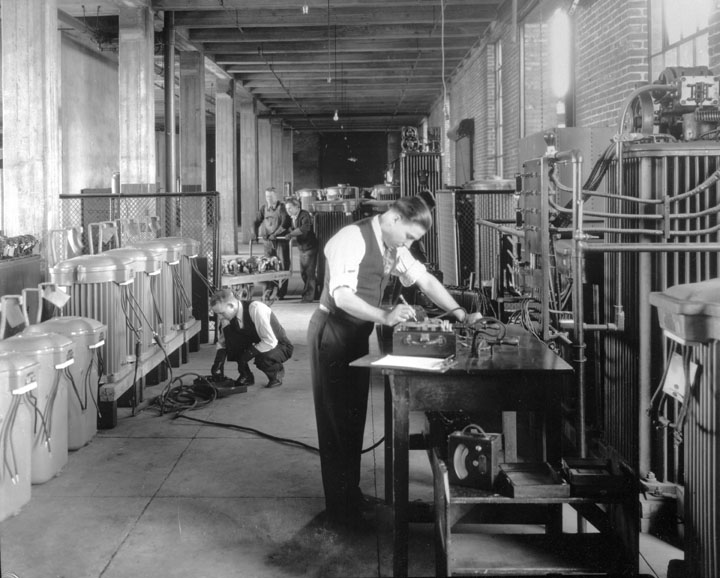
Locate an element on the screen. The width and height of the screenshot is (720, 578). bins is located at coordinates (60, 400).